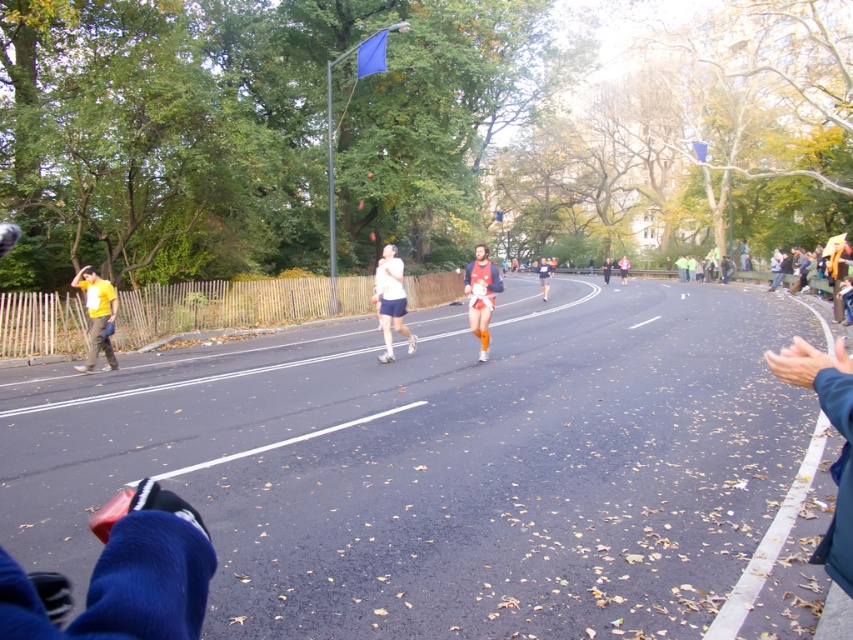
You are a runner in the marathon and you see two points marked on the map. The first point is at coordinates point (x=44, y=468) and the second point is at point (x=485, y=291). Which point is closer to your current position if you are following the race route?

Point (x=44, y=468) is in front of point (x=485, y=291), so it is closer to your current position along the race route.

You are a photographer positioned at the starting line of the marathon. You need to capture a photo that includes both the yellow matte shirt at left and the orange fabric runner at center. Which runner should you focus on first to ensure both are in frame?

You should focus on the orange fabric runner at center first because the yellow matte shirt at left is shorter than the orange fabric runner at center, so adjusting the camera angle to include the taller runner will naturally include the shorter one as well.

You are a photographer positioned at the starting line of the marathon. You want to capture a photo of both the white running shoes at center and the orange fabric runner at center in the same frame. Which object should you zoom out to include first?

The white running shoes at center is wider than the orange fabric runner at center, so you should zoom out to include the white running shoes at center first to ensure both fit in the frame.